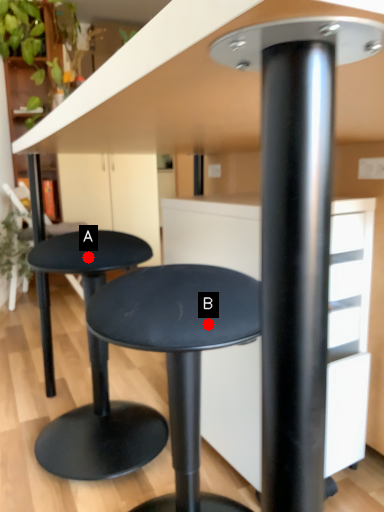
Question: Two points are circled on the image, labeled by A and B beside each circle. Which point is farther from the camera taking this photo?

Choices:
 (A) A is further
 (B) B is further

Answer: (A)